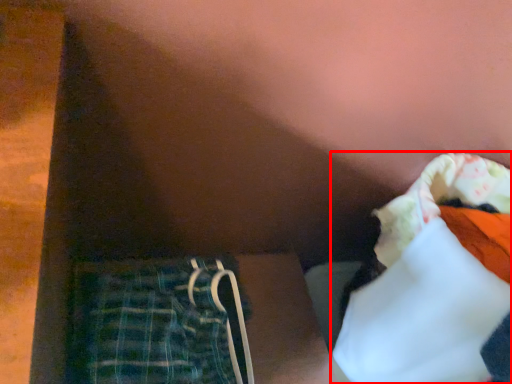
Question: From the image's perspective, where is clothing (annotated by the red box) located in relation to trousers in the image?

Choices:
 (A) below
 (B) above

Answer: (B)